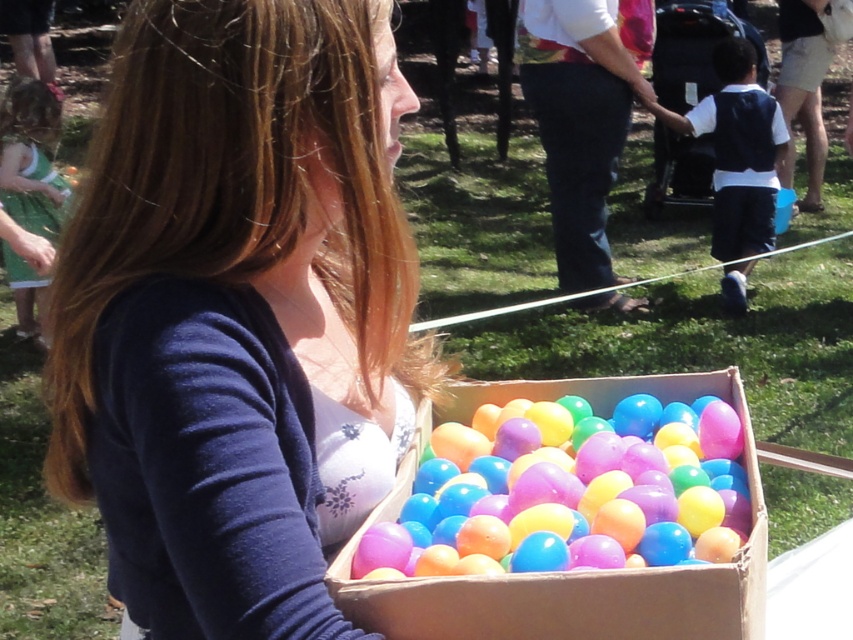
You are organizing a clothing display and need to arrange the matte white tank top at center and denim pants at center next to each other. Which item should you place on the left side to ensure they fit within a 1.2 meter wide display area?

The matte white tank top at center has a lesser width compared to denim pants at center. To fit within the 1.2 meter display area, place the wider denim pants at center on the left and the narrower matte white tank top at center next to it, as this arrangement allows better visibility and balance given their size difference.

You are organizing an Easter egg hunt and have to place the translucent plastic eggs at center and the white cotton shirt at right in a way that ensures the eggs are easily visible to children. Considering their sizes, which object should be placed higher to ensure visibility?

The translucent plastic eggs at center should be placed higher since they are smaller than the white cotton shirt at right, making them harder to spot from a distance.

You are organizing an Easter egg hunt and need to place the matte white tank top at center and the translucent plastic eggs at center in a way that they are exactly 8 inches apart. Based on the scene, can you confirm if their current placement meets this requirement?

The matte white tank top at center and translucent plastic eggs at center are 7.86 inches apart from each other, which is slightly less than the required 8 inches. Therefore, they are not currently placed exactly 8 inches apart.